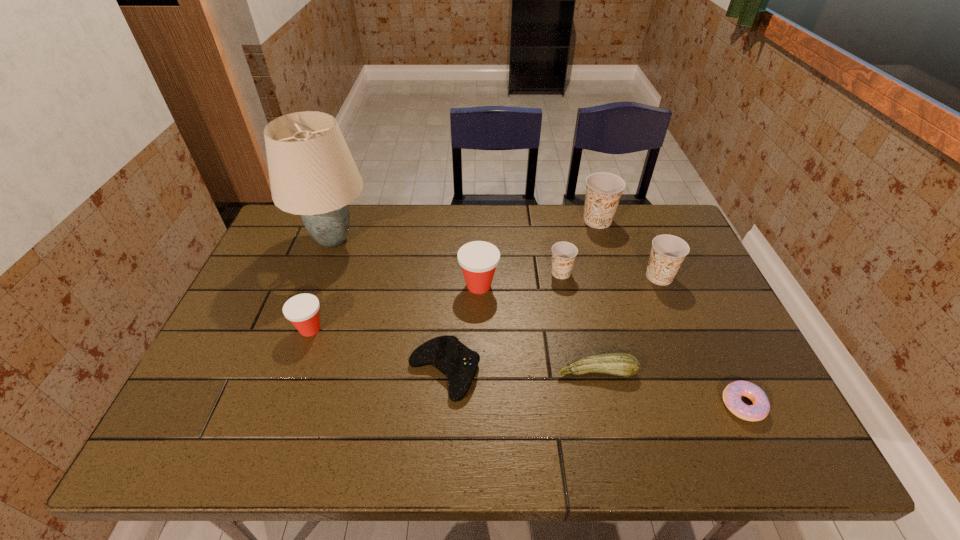
You are a GUI agent. You are given a task and a screenshot of the screen. Output one action in this format:
    pyautogui.click(x=<x>, y=<y>)
    Task: Click on the blank region between the white lampshade and the farthest orange Dixie cup
    The width and height of the screenshot is (960, 540).
    Given the screenshot: What is the action you would take?
    pyautogui.click(x=466, y=230)

You are a GUI agent. You are given a task and a screenshot of the screen. Output one action in this format:
    pyautogui.click(x=<x>, y=<y>)
    Task: Click on the vacant space that's between the tallest object and the zucchini
    
    Given the screenshot: What is the action you would take?
    tap(465, 306)

Find the location of a particular element. vacant space that is in between the control and the rightmost orange Dixie cup is located at coordinates (552, 324).

The height and width of the screenshot is (540, 960). I want to click on vacant point located between the shortest object and the control, so click(x=593, y=388).

Where is `free point between the shortest object and the biggest orange Dixie cup`? Image resolution: width=960 pixels, height=540 pixels. free point between the shortest object and the biggest orange Dixie cup is located at coordinates (670, 313).

Locate an element on the screen. The height and width of the screenshot is (540, 960). free point between the lampshade and the second orange Dixie cup from right to left is located at coordinates (466, 230).

Image resolution: width=960 pixels, height=540 pixels. I want to click on free space between the sixth farthest object and the doughnut, so click(526, 367).

You are a GUI agent. You are given a task and a screenshot of the screen. Output one action in this format:
    pyautogui.click(x=<x>, y=<y>)
    Task: Click on the vacant space in between the control and the bigger red-orange Dixie cup
    
    Given the screenshot: What is the action you would take?
    pyautogui.click(x=462, y=329)

Find the location of a particular element. This screenshot has width=960, height=540. unoccupied area between the control and the tallest object is located at coordinates (389, 306).

Select which object is the eighth closest to the left red-orange Dixie cup. Please provide its 2D coordinates. Your answer should be formatted as a tuple, i.e. [(x, y)], where the tuple contains the x and y coordinates of a point satisfying the conditions above.

[(732, 394)]